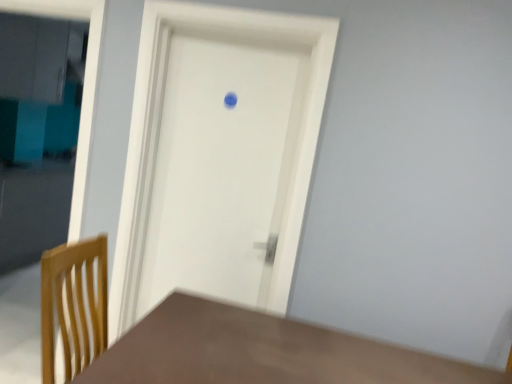
The image size is (512, 384). What do you see at coordinates (262, 352) in the screenshot? I see `brown matte table at lower left` at bounding box center [262, 352].

Image resolution: width=512 pixels, height=384 pixels. I want to click on brown matte table at lower left, so click(262, 352).

The height and width of the screenshot is (384, 512). Describe the element at coordinates (220, 169) in the screenshot. I see `white matte door at center` at that location.

Measure the distance between point (264, 147) and camera.

Point (264, 147) and camera are 7.04 feet apart.

Measure the distance between white matte door at center and camera.

The distance of white matte door at center from camera is 6.54 feet.

Identify the location of white matte door at center. The height and width of the screenshot is (384, 512). (220, 169).

Locate an element on the screen. brown matte table at lower left is located at coordinates (262, 352).

Which is more to the right, brown matte table at lower left or white matte door at center?

brown matte table at lower left is more to the right.

Which object is further away from the camera taking this photo, brown matte table at lower left or white matte door at center?

white matte door at center.

Is point (264, 316) less distant than point (139, 306)?

Yes.

From the image's perspective, is brown matte table at lower left below white matte door at center?

Yes, from the image's perspective, brown matte table at lower left is beneath white matte door at center.

From a real-world perspective, does brown matte table at lower left stand above white matte door at center?

No, from a real-world perspective, brown matte table at lower left is not above white matte door at center.

Can you confirm if brown matte table at lower left is thinner than white matte door at center?

No.

Considering the relative sizes of brown matte table at lower left and white matte door at center in the image provided, is brown matte table at lower left shorter than white matte door at center?

Indeed, brown matte table at lower left has a lesser height compared to white matte door at center.

Is brown matte table at lower left bigger than white matte door at center?

Correct, brown matte table at lower left is larger in size than white matte door at center.

Looking at this image, is white matte door at center a part of brown matte table at lower left?

No, white matte door at center is not a part of brown matte table at lower left.

Is brown matte table at lower left next to white matte door at center?

They are not placed beside each other.

In the scene shown: Is brown matte table at lower left facing towards white matte door at center?

No, brown matte table at lower left is not facing towards white matte door at center.

Find the location of a particular element. The width and height of the screenshot is (512, 384). table in front of the white matte door at center is located at coordinates (262, 352).

Which object is positioned more to the left, white matte door at center or brown matte table at lower left?

white matte door at center.

Which object is more forward, white matte door at center or brown matte table at lower left?

Positioned in front is brown matte table at lower left.

Which point is more forward, (189,152) or (331,381)?

Positioned in front is point (331,381).

From the image's perspective, which is above, white matte door at center or brown matte table at lower left?

white matte door at center, from the image's perspective.

From a real-world perspective, relative to brown matte table at lower left, is white matte door at center vertically above or below?

From a real-world perspective, white matte door at center is physically above brown matte table at lower left.

Does white matte door at center have a lesser width compared to brown matte table at lower left?

Yes.

In terms of height, does white matte door at center look taller or shorter compared to brown matte table at lower left?

white matte door at center is taller than brown matte table at lower left.

Considering the relative sizes of white matte door at center and brown matte table at lower left in the image provided, is white matte door at center bigger than brown matte table at lower left?

Actually, white matte door at center might be smaller than brown matte table at lower left.

Would you say brown matte table at lower left is part of white matte door at center's contents?

No, brown matte table at lower left is not a part of white matte door at center.

Is white matte door at center next to brown matte table at lower left?

No, white matte door at center is not next to brown matte table at lower left.

Could you tell me if white matte door at center is facing brown matte table at lower left?

No, white matte door at center is not oriented towards brown matte table at lower left.

Can you tell me how much white matte door at center and brown matte table at lower left differ in facing direction?

They differ by 90 degrees in their facing directions.

You are a GUI agent. You are given a task and a screenshot of the screen. Output one action in this format:
    pyautogui.click(x=<x>, y=<y>)
    Task: Click on the door located above the brown matte table at lower left (from the image's perspective)
    The width and height of the screenshot is (512, 384).
    Given the screenshot: What is the action you would take?
    pyautogui.click(x=220, y=169)

The width and height of the screenshot is (512, 384). Identify the location of table on the right of white matte door at center. (262, 352).

At what (x,y) coordinates should I click in order to perform the action: click on door on the left of the brown matte table at lower left. Please return your answer as a coordinate pair (x, y). This screenshot has width=512, height=384. Looking at the image, I should click on (220, 169).